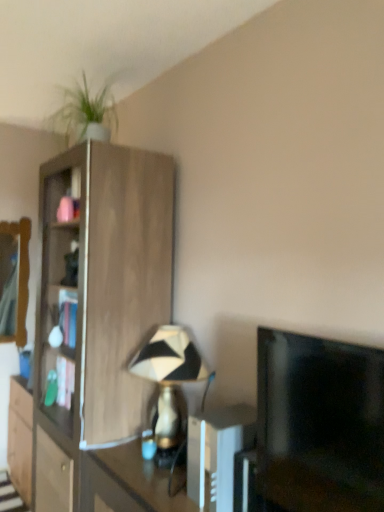
Question: Considering the relative sizes of wooden cabinet at left and black and white geometric lampshade at center in the image provided, is wooden cabinet at left bigger than black and white geometric lampshade at center?

Choices:
 (A) no
 (B) yes

Answer: (B)

Question: From a real-world perspective, is wooden cabinet at left on black and white geometric lampshade at center?

Choices:
 (A) no
 (B) yes

Answer: (B)

Question: Does wooden cabinet at left have a greater width compared to black and white geometric lampshade at center?

Choices:
 (A) yes
 (B) no

Answer: (A)

Question: Is wooden cabinet at left further to the viewer compared to black and white geometric lampshade at center?

Choices:
 (A) yes
 (B) no

Answer: (A)

Question: Does wooden cabinet at left appear on the right side of black and white geometric lampshade at center?

Choices:
 (A) no
 (B) yes

Answer: (A)

Question: Is wooden cabinet at left oriented towards black and white geometric lampshade at center?

Choices:
 (A) no
 (B) yes

Answer: (A)

Question: Is black and white geometric lampshade at center located outside wooden mirror at left?

Choices:
 (A) yes
 (B) no

Answer: (A)

Question: Is black and white geometric lampshade at center behind wooden mirror at left?

Choices:
 (A) no
 (B) yes

Answer: (A)

Question: Is the position of black and white geometric lampshade at center less distant than that of wooden mirror at left?

Choices:
 (A) yes
 (B) no

Answer: (A)

Question: From a real-world perspective, is black and white geometric lampshade at center positioned over wooden mirror at left based on gravity?

Choices:
 (A) yes
 (B) no

Answer: (B)

Question: Considering the relative sizes of black and white geometric lampshade at center and wooden mirror at left in the image provided, is black and white geometric lampshade at center taller than wooden mirror at left?

Choices:
 (A) no
 (B) yes

Answer: (A)

Question: Can you confirm if black and white geometric lampshade at center is smaller than wooden mirror at left?

Choices:
 (A) no
 (B) yes

Answer: (A)

Question: Would you say black glossy tv at right is a long distance from white plastic remote control at center?

Choices:
 (A) no
 (B) yes

Answer: (A)